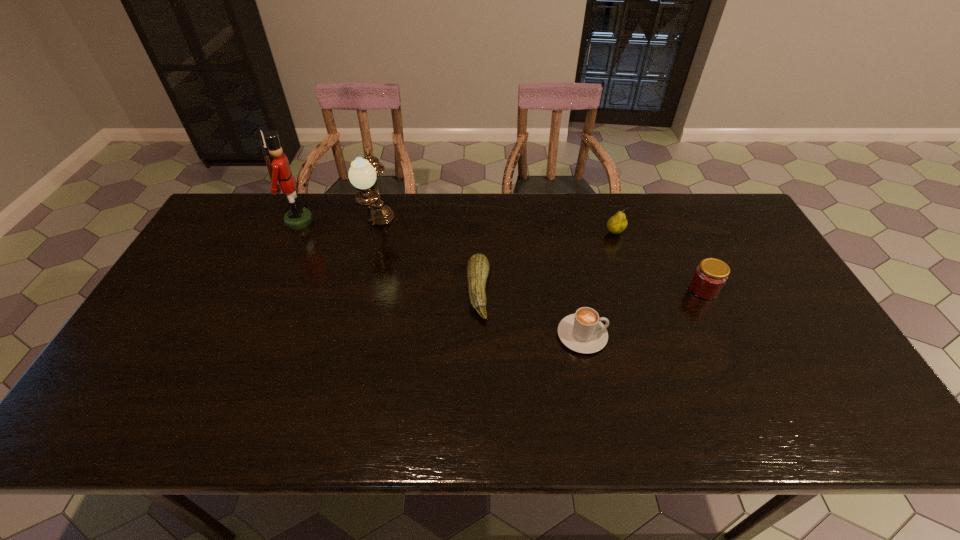
The width and height of the screenshot is (960, 540). I want to click on the tallest object, so (297, 217).

At what (x,y) coordinates should I click in order to perform the action: click on the leftmost object. Please return your answer as a coordinate pair (x, y). Looking at the image, I should click on (297, 217).

Locate an element on the screen. the fifth shortest object is located at coordinates (362, 174).

This screenshot has height=540, width=960. Find the location of `the fifth object from right to left`. the fifth object from right to left is located at coordinates (x=362, y=174).

Where is `the fifth object from left to right`? This screenshot has width=960, height=540. the fifth object from left to right is located at coordinates (616, 224).

In order to click on the rightmost object in this screenshot , I will do `click(710, 276)`.

I want to click on the third object from right to left, so click(x=583, y=332).

Identify the location of cappuccino. (583, 332).

This screenshot has width=960, height=540. Identify the location of the shortest object. (478, 266).

The width and height of the screenshot is (960, 540). In order to click on the third object from left to right in this screenshot , I will do `click(478, 266)`.